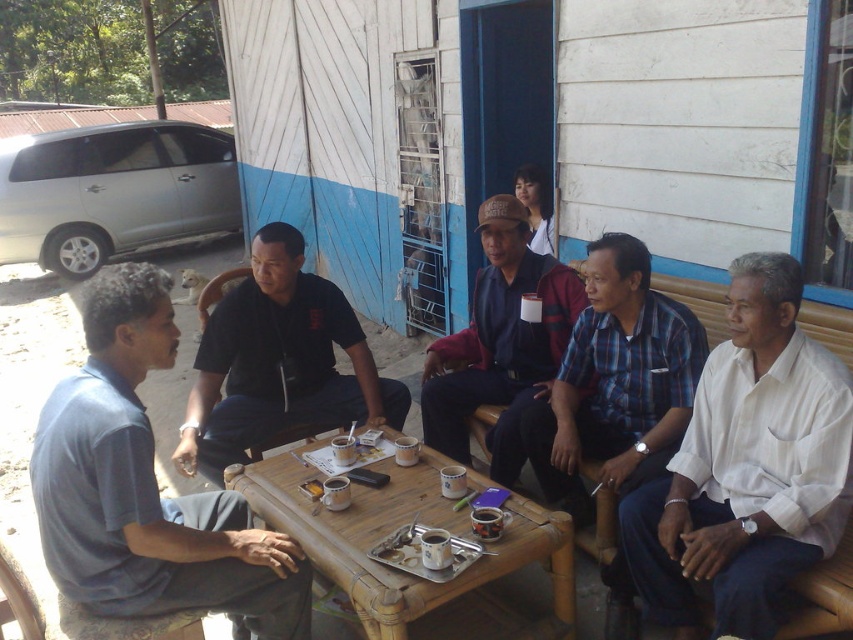
Does blue cotton shirt at left have a lesser width compared to black matte shirt at center?

Yes, blue cotton shirt at left is thinner than black matte shirt at center.

Identify the location of blue cotton shirt at left. This screenshot has width=853, height=640. (146, 486).

Identify the location of blue cotton shirt at left. (146, 486).

Between white cotton shirt at center and blue plaid shirt at center, which one is positioned lower?

white cotton shirt at center is below.

Who is more forward, (763, 385) or (627, 394)?

Point (763, 385)

In order to click on white cotton shirt at center in this screenshot , I will do `click(747, 467)`.

Who is more distant from viewer, [131,260] or [508,474]?

Point [131,260]

Is point (200, 560) in front of point (483, 365)?

That is True.

Describe the element at coordinates (146, 486) in the screenshot. I see `blue cotton shirt at left` at that location.

Locate an element on the screen. blue cotton shirt at left is located at coordinates (146, 486).